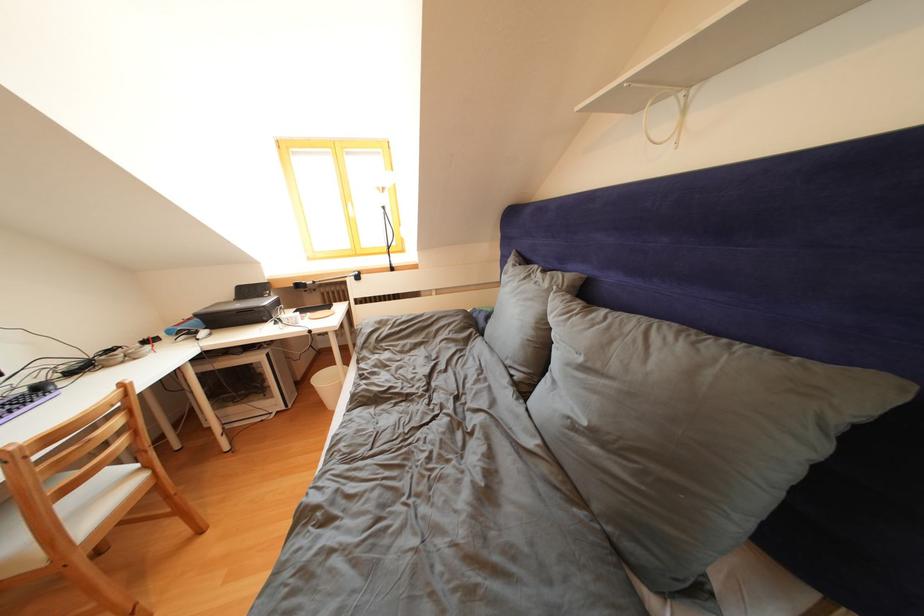
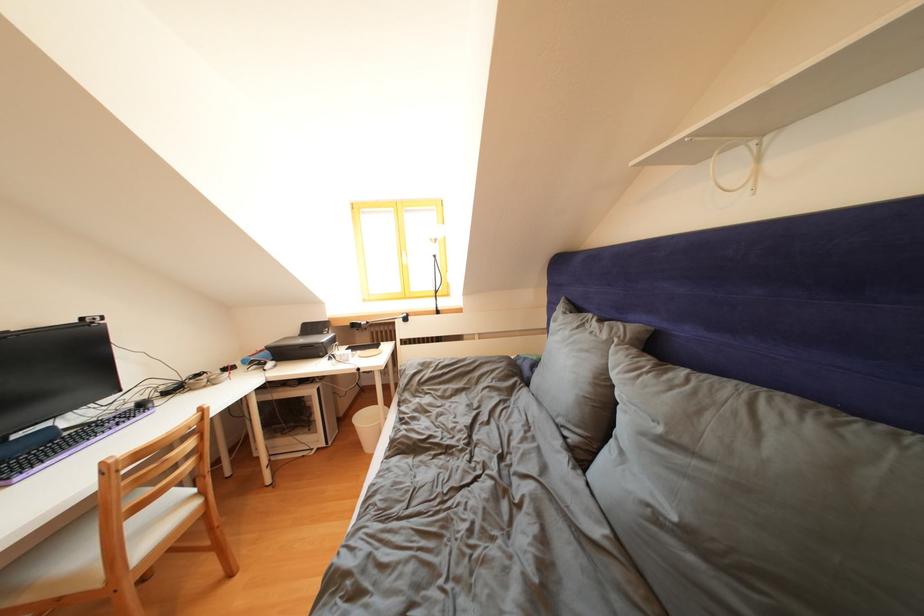
Where in the second image is the point corresponding to pixel 553 290 from the first image?

(612, 341)